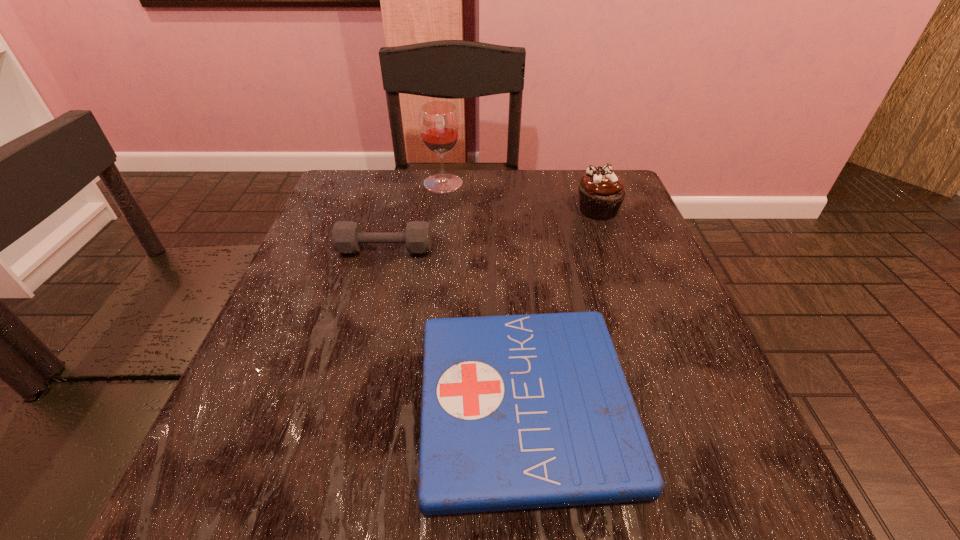
You are a GUI agent. You are given a task and a screenshot of the screen. Output one action in this format:
    pyautogui.click(x=<x>, y=<y>)
    Task: Click on the tallest object
    The height and width of the screenshot is (540, 960).
    Given the screenshot: What is the action you would take?
    pyautogui.click(x=439, y=124)

Identify the location of the farthest object. (439, 124).

The image size is (960, 540). Find the location of `the second farthest object`. the second farthest object is located at coordinates click(601, 193).

Locate an element on the screen. The image size is (960, 540). cupcake is located at coordinates (601, 193).

I want to click on the third tallest object, so click(x=347, y=237).

Locate an element on the screen. dumbbell is located at coordinates (347, 237).

Identify the location of the nearest object. (528, 411).

Locate an element on the screen. This screenshot has width=960, height=540. the first-aid kit is located at coordinates point(528,411).

Find the location of a particular element. free region located 0.170m on the front of the farthest object is located at coordinates (437, 234).

Where is `vacant space located 0.320m on the left of the third nearest object`? This screenshot has width=960, height=540. vacant space located 0.320m on the left of the third nearest object is located at coordinates (440, 210).